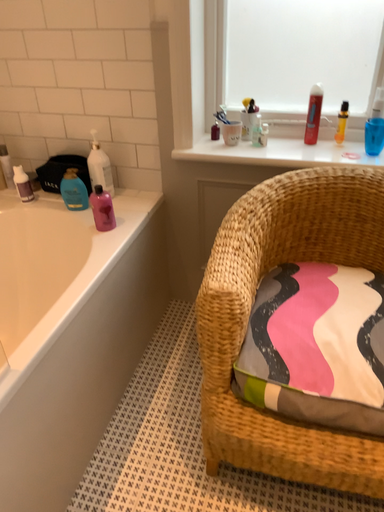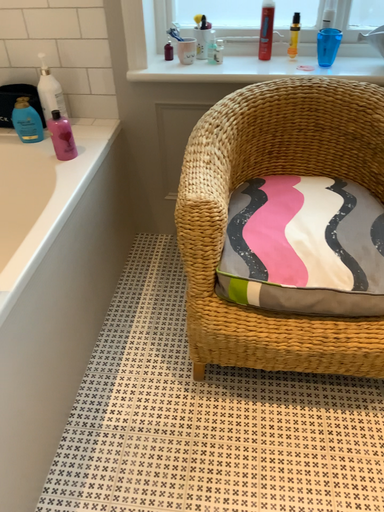
Question: Which way did the camera rotate in the video?

Choices:
 (A) rotated right
 (B) rotated left

Answer: (A)